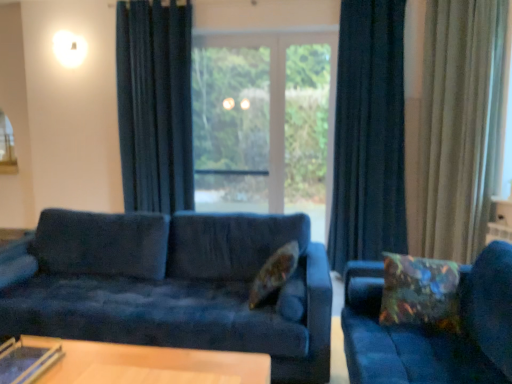
Question: In which direction should I rotate to look at floral fabric pillow at center, which is counted as the 1th pillow, starting from the left?

Choices:
 (A) right
 (B) left

Answer: (A)

Question: From a real-world perspective, is dark blue velvet curtain at center, which is counted as the second curtain, starting from the right, on multicolored fabric pillow at right, which appears as the 1th pillow when viewed from the right?

Choices:
 (A) yes
 (B) no

Answer: (A)

Question: Considering the relative positions of dark blue velvet curtain at center, which is the 2th curtain from left to right, and multicolored fabric pillow at right, which appears as the 1th pillow when viewed from the right, in the image provided, is dark blue velvet curtain at center, which is the 2th curtain from left to right, in front of multicolored fabric pillow at right, which appears as the 1th pillow when viewed from the right,?

Choices:
 (A) yes
 (B) no

Answer: (B)

Question: Considering the relative positions of dark blue velvet curtain at center, which is counted as the second curtain, starting from the right, and multicolored fabric pillow at right, placed as the 2th pillow when sorted from left to right, in the image provided, is dark blue velvet curtain at center, which is counted as the second curtain, starting from the right, behind multicolored fabric pillow at right, placed as the 2th pillow when sorted from left to right,?

Choices:
 (A) no
 (B) yes

Answer: (B)

Question: Does dark blue velvet curtain at center, which is the 2th curtain from left to right, contain multicolored fabric pillow at right, placed as the 2th pillow when sorted from left to right?

Choices:
 (A) yes
 (B) no

Answer: (B)

Question: From a real-world perspective, is dark blue velvet curtain at center, which is the 2th curtain from left to right, below multicolored fabric pillow at right, which appears as the 1th pillow when viewed from the right?

Choices:
 (A) no
 (B) yes

Answer: (A)

Question: Does dark blue velvet curtain at center, which is counted as the second curtain, starting from the right, have a lesser height compared to multicolored fabric pillow at right, placed as the 2th pillow when sorted from left to right?

Choices:
 (A) no
 (B) yes

Answer: (A)

Question: Can you confirm if velvet blue couch at center, arranged as the 1th studio couch when viewed from the left, is wider than velvet blue couch at right, arranged as the first studio couch when viewed from the right?

Choices:
 (A) no
 (B) yes

Answer: (B)

Question: Is velvet blue couch at center, the 2th studio couch positioned from the right, closer to the viewer compared to velvet blue couch at right, arranged as the 2th studio couch when viewed from the left?

Choices:
 (A) no
 (B) yes

Answer: (A)

Question: Is velvet blue couch at center, the 2th studio couch positioned from the right, thinner than velvet blue couch at right, arranged as the first studio couch when viewed from the right?

Choices:
 (A) yes
 (B) no

Answer: (B)

Question: Does velvet blue couch at center, the 2th studio couch positioned from the right, have a smaller size compared to velvet blue couch at right, arranged as the 2th studio couch when viewed from the left?

Choices:
 (A) yes
 (B) no

Answer: (B)

Question: From a real-world perspective, is velvet blue couch at center, the 2th studio couch positioned from the right, positioned under velvet blue couch at right, arranged as the first studio couch when viewed from the right, based on gravity?

Choices:
 (A) no
 (B) yes

Answer: (A)

Question: Is velvet blue couch at center, arranged as the 1th studio couch when viewed from the left, oriented away from velvet blue couch at right, arranged as the 2th studio couch when viewed from the left?

Choices:
 (A) yes
 (B) no

Answer: (B)

Question: From a real-world perspective, is floral fabric pillow at center, which is counted as the 1th pillow, starting from the left, positioned under transparent glass screen door at center based on gravity?

Choices:
 (A) yes
 (B) no

Answer: (A)